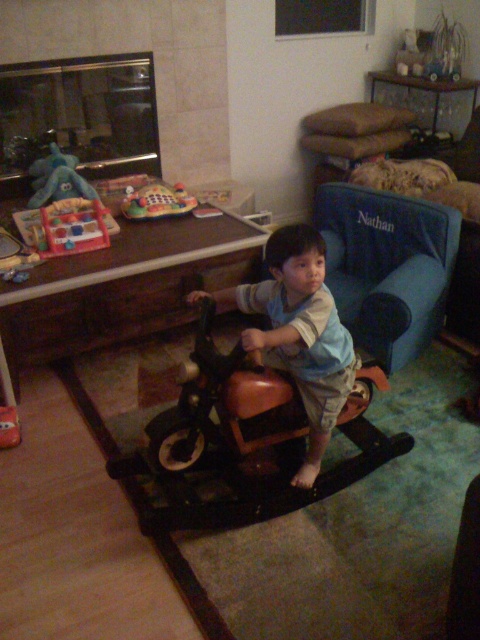
What do you see at coordinates (58, 179) in the screenshot? Image resolution: width=480 pixels, height=640 pixels. I see `blue plush elephant at upper left` at bounding box center [58, 179].

Is blue plush elephant at upper left further to camera compared to plastic colorful play mat at center?

No, blue plush elephant at upper left is closer to the viewer.

Find the location of `blue plush elephant at upper left`. blue plush elephant at upper left is located at coordinates (58, 179).

Image resolution: width=480 pixels, height=640 pixels. I want to click on blue plush elephant at upper left, so click(58, 179).

Is point (253, 328) behind point (54, 147)?

Yes, it is.

Is point (265, 298) positioned in front of point (57, 188)?

Yes.

This screenshot has height=640, width=480. I want to click on brown leather motorcycle at center, so click(x=298, y=332).

Can you confirm if brown leather motorcycle at center is positioned below plastic colorful play mat at center?

Yes, brown leather motorcycle at center is below plastic colorful play mat at center.

Is brown leather motorcycle at center positioned in front of plastic colorful play mat at center?

Yes, brown leather motorcycle at center is closer to the viewer.

In order to click on brown leather motorcycle at center in this screenshot , I will do `click(298, 332)`.